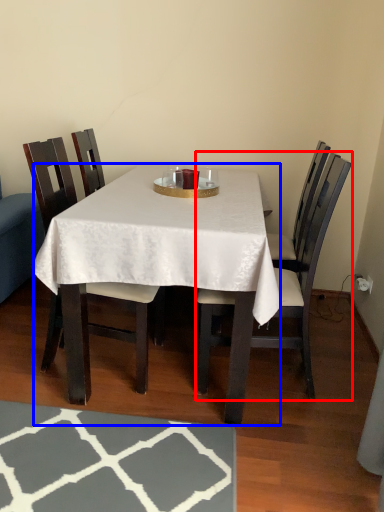
Question: Which object appears farthest to the camera in this image, chair (highlighted by a red box) or desk (highlighted by a blue box)?

Choices:
 (A) chair
 (B) desk

Answer: (A)